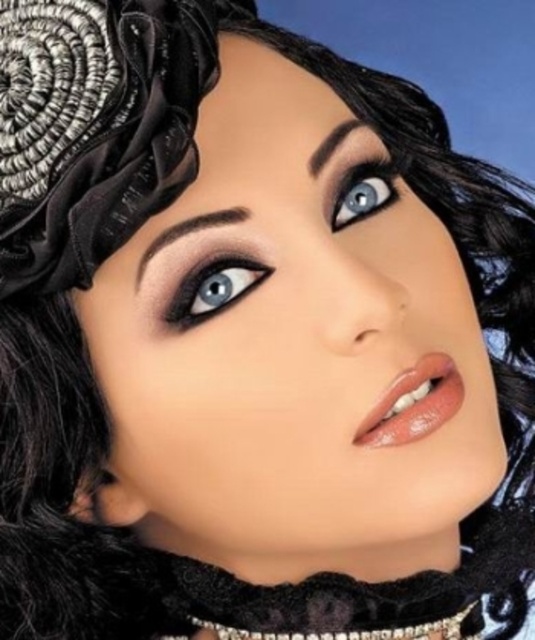
Question: Which is nearer to the smokey matte eye at center?

Choices:
 (A) satin black headdress at upper left
 (B) blue glossy eye at upper center

Answer: (B)

Question: Is satin black headdress at upper left closer to the viewer compared to smokey matte eye at center?

Choices:
 (A) no
 (B) yes

Answer: (B)

Question: Does smokey matte eye at center lie behind blue glossy eye at upper center?

Choices:
 (A) yes
 (B) no

Answer: (B)

Question: Among these points, which one is nearest to the camera?

Choices:
 (A) (175, 323)
 (B) (83, 266)
 (C) (358, 216)

Answer: (B)

Question: Which of the following is the farthest from the observer?

Choices:
 (A) (337, 195)
 (B) (187, 77)

Answer: (A)

Question: Where is smokey matte eye at center located in relation to blue glossy eye at upper center in the image?

Choices:
 (A) left
 (B) right

Answer: (A)